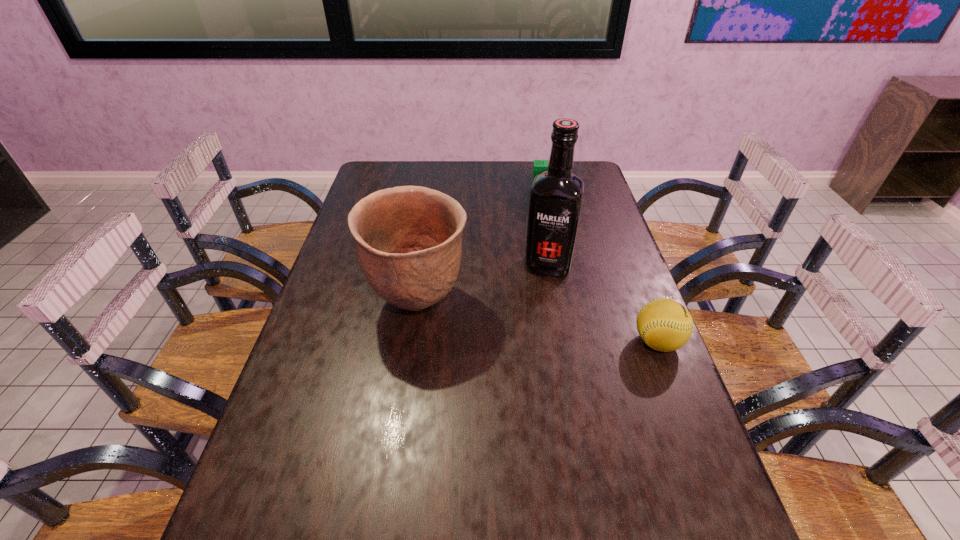
At what (x,y) coordinates should I click in order to perform the action: click on the leftmost object. Please return your answer as a coordinate pair (x, y). This screenshot has width=960, height=540. Looking at the image, I should click on (408, 240).

Find the location of `pottery`. pottery is located at coordinates (408, 240).

This screenshot has width=960, height=540. In order to click on the rightmost object in this screenshot , I will do `click(665, 325)`.

This screenshot has width=960, height=540. In order to click on the farthest object in this screenshot , I will do `click(539, 166)`.

What are the coordinates of `the tallest object` in the screenshot? It's located at (556, 196).

Where is `vacant space located 0.170m on the right of the third shortest object`? vacant space located 0.170m on the right of the third shortest object is located at coordinates (530, 303).

I want to click on free space located 0.240m on the front-facing side of the alarm clock, so pos(554,237).

The width and height of the screenshot is (960, 540). In order to click on free space located on the front-facing side of the alarm clock in this screenshot , I will do `click(552, 222)`.

Where is `vacant space situated on the front-facing side of the alarm clock`? vacant space situated on the front-facing side of the alarm clock is located at coordinates (555, 244).

Locate an element on the screen. This screenshot has height=540, width=960. free space located on the front-facing side of the liquor is located at coordinates (541, 297).